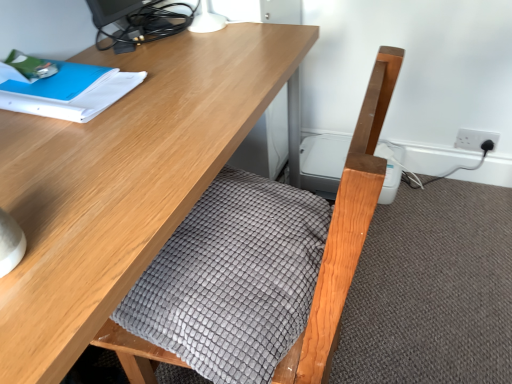
Question: Is wooden desk at center to the left or to the right of blue paper at upper left in the image?

Choices:
 (A) left
 (B) right

Answer: (B)

Question: In terms of width, does wooden desk at center look wider or thinner when compared to blue paper at upper left?

Choices:
 (A) thin
 (B) wide

Answer: (B)

Question: Estimate the real-world distances between objects in this image. Which object is farther from the gray textured blanket at center?

Choices:
 (A) wooden desk at center
 (B) matte black monitor at upper left
 (C) white plastic socket at upper right
 (D) blue paper at upper left

Answer: (C)

Question: Estimate the real-world distances between objects in this image. Which object is closer to the white plastic socket at upper right?

Choices:
 (A) wooden desk at center
 (B) gray textured blanket at center
 (C) matte black monitor at upper left
 (D) blue paper at upper left

Answer: (C)